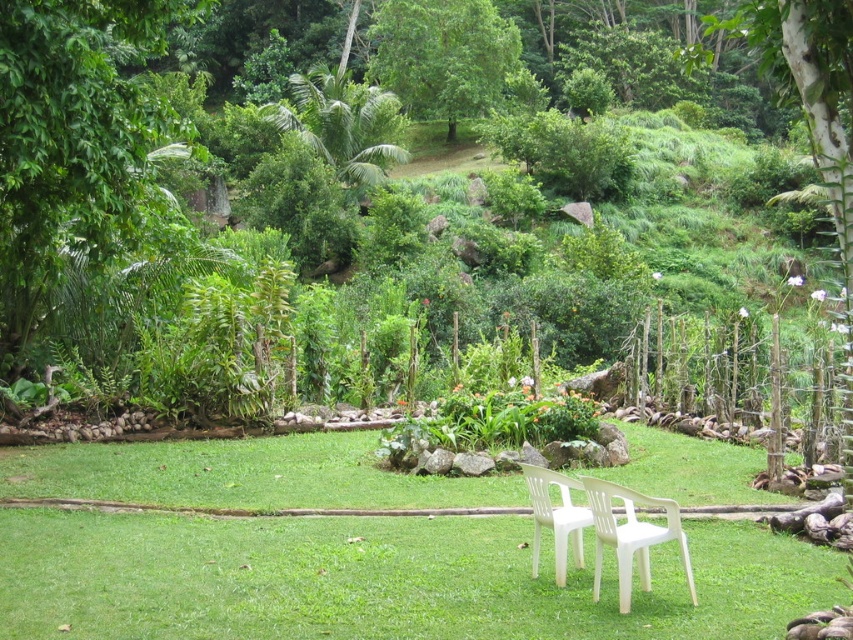
Question: Among these objects, which one is farthest from the camera?

Choices:
 (A) green leafy tree at left
 (B) green leafy tree at upper center

Answer: (B)

Question: Can you confirm if green leafy tree at left is bigger than white plastic chairs at center?

Choices:
 (A) yes
 (B) no

Answer: (A)

Question: Which of these objects is positioned closest to the green leafy tree at upper center?

Choices:
 (A) white plastic chair at center
 (B) green leafy tree at left

Answer: (B)

Question: Can you confirm if green leafy tree at left is smaller than white plastic chair at center?

Choices:
 (A) no
 (B) yes

Answer: (A)

Question: Is green leafy tree at left positioned before green leafy tree at upper center?

Choices:
 (A) no
 (B) yes

Answer: (B)

Question: Which point is farther from the camera taking this photo?

Choices:
 (A) (581, 481)
 (B) (84, 125)

Answer: (B)